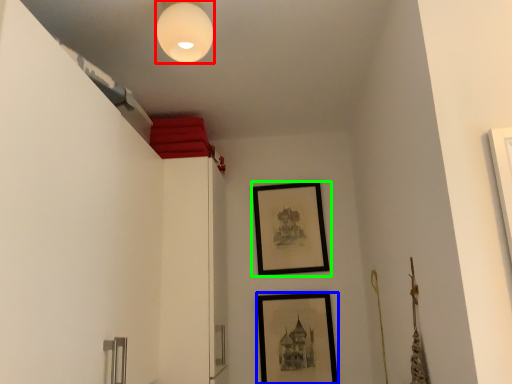
Question: Which object is positioned farthest from light fixture (highlighted by a red box)? Select from picture frame (highlighted by a blue box) and picture frame (highlighted by a green box).

Choices:
 (A) picture frame
 (B) picture frame

Answer: (A)